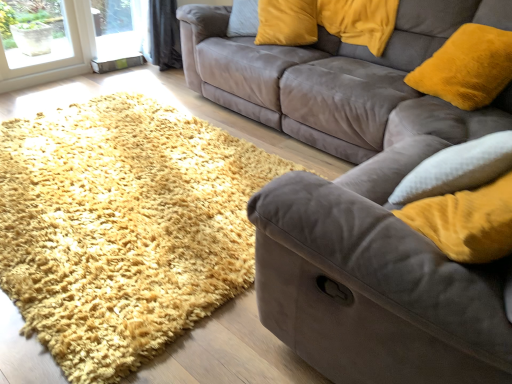
Question: Can you confirm if velvet gray couch at center, which ranks as the second studio couch in front-to-back order, is shorter than suede couch at center, the second studio couch positioned from the back?

Choices:
 (A) no
 (B) yes

Answer: (B)

Question: Considering the relative sizes of velvet gray couch at center, which appears as the 1th studio couch when viewed from the back, and suede couch at center, the second studio couch positioned from the back, in the image provided, is velvet gray couch at center, which appears as the 1th studio couch when viewed from the back, smaller than suede couch at center, the second studio couch positioned from the back,?

Choices:
 (A) yes
 (B) no

Answer: (A)

Question: Is velvet gray couch at center, which appears as the 1th studio couch when viewed from the back, further to camera compared to suede couch at center, the second studio couch positioned from the back?

Choices:
 (A) no
 (B) yes

Answer: (B)

Question: Is velvet gray couch at center, which ranks as the second studio couch in front-to-back order, next to suede couch at center, the second studio couch positioned from the back?

Choices:
 (A) no
 (B) yes

Answer: (A)

Question: Does velvet gray couch at center, which appears as the 1th studio couch when viewed from the back, appear on the right side of suede couch at center, the second studio couch positioned from the back?

Choices:
 (A) yes
 (B) no

Answer: (B)

Question: Relative to velvet gray couch at center, which ranks as the second studio couch in front-to-back order, is suede couch at center, the second studio couch positioned from the back, in front or behind?

Choices:
 (A) front
 (B) behind

Answer: (A)

Question: From the image's perspective, is suede couch at center, the 1th studio couch from the front, above or below velvet gray couch at center, which ranks as the second studio couch in front-to-back order?

Choices:
 (A) below
 (B) above

Answer: (A)

Question: In terms of size, does suede couch at center, the second studio couch positioned from the back, appear bigger or smaller than velvet gray couch at center, which ranks as the second studio couch in front-to-back order?

Choices:
 (A) small
 (B) big

Answer: (B)

Question: Is suede couch at center, the second studio couch positioned from the back, inside or outside of velvet gray couch at center, which appears as the 1th studio couch when viewed from the back?

Choices:
 (A) outside
 (B) inside

Answer: (A)

Question: In the image, is shaggy yellow rug at lower left positioned in front of or behind suede couch at center, the 1th studio couch from the front?

Choices:
 (A) behind
 (B) front

Answer: (A)

Question: From a real-world perspective, is shaggy yellow rug at lower left above or below suede couch at center, the second studio couch positioned from the back?

Choices:
 (A) above
 (B) below

Answer: (B)

Question: Considering the positions of point (71, 140) and point (300, 183), is point (71, 140) closer or farther from the camera than point (300, 183)?

Choices:
 (A) closer
 (B) farther

Answer: (B)

Question: In terms of width, does shaggy yellow rug at lower left look wider or thinner when compared to suede couch at center, the 1th studio couch from the front?

Choices:
 (A) wide
 (B) thin

Answer: (A)

Question: Is velvet yellow pillow at upper right, which appears as the first pillow when viewed from the right, taller or shorter than velvet yellow pillow at upper center, which is counted as the first pillow, starting from the left?

Choices:
 (A) short
 (B) tall

Answer: (A)

Question: Looking at their shapes, would you say velvet yellow pillow at upper right, arranged as the 2th pillow when viewed from the left, is wider or thinner than velvet yellow pillow at upper center, which is counted as the first pillow, starting from the left?

Choices:
 (A) wide
 (B) thin

Answer: (A)